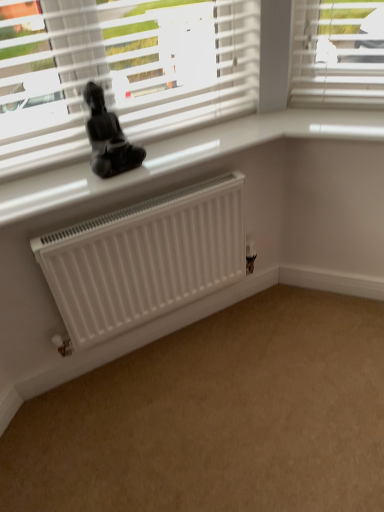
Question: Is black glossy statue at upper center taller than white matte radiator at center?

Choices:
 (A) yes
 (B) no

Answer: (B)

Question: Considering the relative sizes of black glossy statue at upper center and white matte radiator at center in the image provided, is black glossy statue at upper center bigger than white matte radiator at center?

Choices:
 (A) no
 (B) yes

Answer: (A)

Question: Is black glossy statue at upper center thinner than white matte radiator at center?

Choices:
 (A) yes
 (B) no

Answer: (A)

Question: Is white matte radiator at center at the back of black glossy statue at upper center?

Choices:
 (A) yes
 (B) no

Answer: (B)

Question: Is black glossy statue at upper center to the right of white matte radiator at center from the viewer's perspective?

Choices:
 (A) yes
 (B) no

Answer: (B)

Question: From their relative heights in the image, would you say white matte radiator at center is taller or shorter than white matte radiator at lower left?

Choices:
 (A) tall
 (B) short

Answer: (A)

Question: Based on their positions, is white matte radiator at center located to the left or right of white matte radiator at lower left?

Choices:
 (A) right
 (B) left

Answer: (B)

Question: Considering their positions, is white matte radiator at center located in front of or behind white matte radiator at lower left?

Choices:
 (A) front
 (B) behind

Answer: (B)

Question: Considering the positions of point (135, 212) and point (185, 501), is point (135, 212) closer or farther from the camera than point (185, 501)?

Choices:
 (A) farther
 (B) closer

Answer: (A)

Question: In terms of height, does white glossy window sill at upper center look taller or shorter compared to white matte radiator at lower left?

Choices:
 (A) tall
 (B) short

Answer: (A)

Question: Visually, is white glossy window sill at upper center positioned to the left or to the right of white matte radiator at lower left?

Choices:
 (A) right
 (B) left

Answer: (B)

Question: From a real-world perspective, is white glossy window sill at upper center physically located above or below white matte radiator at lower left?

Choices:
 (A) below
 (B) above

Answer: (B)

Question: Considering the positions of white glossy window sill at upper center and white matte radiator at lower left in the image, is white glossy window sill at upper center wider or thinner than white matte radiator at lower left?

Choices:
 (A) thin
 (B) wide

Answer: (A)

Question: Looking at their shapes, would you say white matte radiator at lower left is wider or thinner than white matte radiator at center?

Choices:
 (A) thin
 (B) wide

Answer: (B)

Question: Based on their positions, is white matte radiator at lower left located to the left or right of white matte radiator at center?

Choices:
 (A) left
 (B) right

Answer: (B)